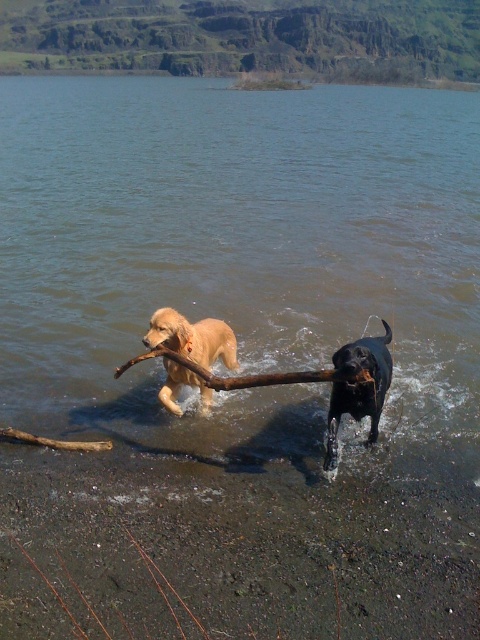
You are a photographer trying to capture the two dogs playing with the branch. Based on the scene, which object, the golden fur dog at center or the brown wood branch at center, would appear larger in your photo?

The golden fur dog at center is taller than the brown wood branch at center, so it would appear larger in the photo.

From the picture: You are a photographer trying to capture the shiny black dog at center and the brown wood branch at center in a single shot. Which object will appear larger in your photo?

The shiny black dog at center will appear larger in the photo because it is closer to the viewer than the brown wood branch at center.

You are standing at the point with coordinates point (186, 372) and want to walk to the point with coordinates point (456, 477). Which direction should you move in?

You should move forward because point (456, 477) is in front of point (186, 372).